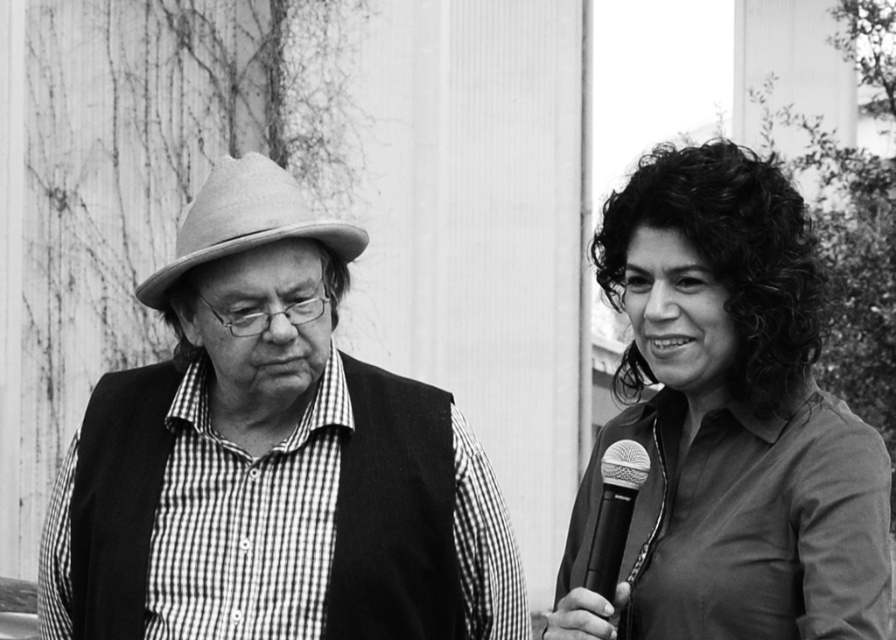
Question: Which is farther from the checkered fabric shirt at left?

Choices:
 (A) metallic silver microphone at right
 (B) felt fedora at left

Answer: (A)

Question: Is checkered fabric shirt at left closer to camera compared to metallic silver microphone at right?

Choices:
 (A) no
 (B) yes

Answer: (A)

Question: Which object is positioned farthest from the curly hair at right?

Choices:
 (A) felt fedora at left
 (B) metallic silver microphone at right
 (C) checkered fabric shirt at left

Answer: (A)

Question: Is checkered fabric shirt at left smaller than metallic silver microphone at right?

Choices:
 (A) yes
 (B) no

Answer: (B)

Question: Which point is farther from the camera taking this photo?

Choices:
 (A) (233, 346)
 (B) (846, 637)

Answer: (A)

Question: Does checkered fabric shirt at left appear under metallic silver microphone at right?

Choices:
 (A) no
 (B) yes

Answer: (B)